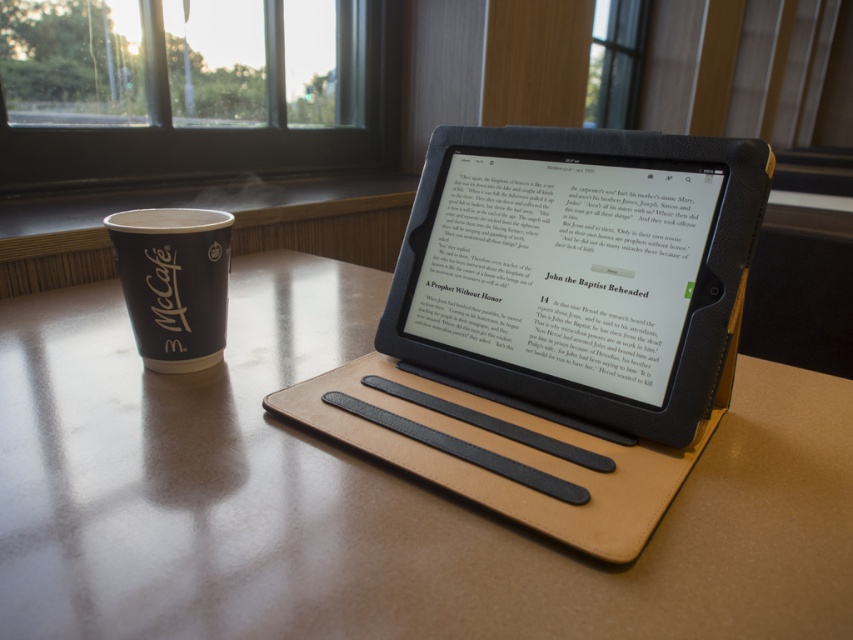
What are the coordinates of the black leather tablet at center?

The coordinates of the black leather tablet at center are at point (556, 323).

You are a photographer standing at a certain distance from the brown leather table at center. If your camera can focus on objects up to 12 inches away, will it be able to capture a clear image of the table?

The distance between the brown leather table at center and the camera is 11.47 inches, which is within the camera focus range of up to 12 inches. Therefore, the camera can capture a clear image of the table.

You are designing a layout for a small desk and need to place both the brown leather table at center and the black paper cup at left on it. Given their sizes, which object should you prioritize placing first to ensure they both fit comfortably?

The brown leather table at center has a larger width than the black paper cup at left, so you should prioritize placing the brown leather table at center first to ensure there is enough space for both objects on the desk.